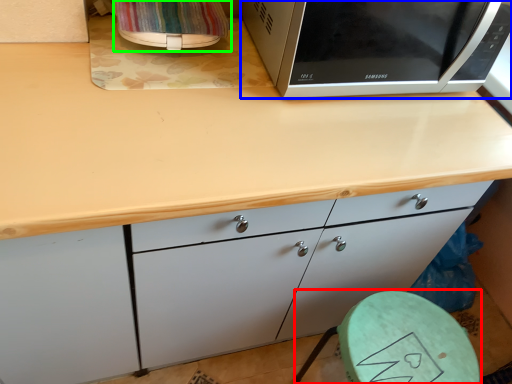
Question: Which object is the farthest from round table (highlighted by a red box)? Choose among these: microwave oven (highlighted by a blue box) or appliance (highlighted by a green box).

Choices:
 (A) microwave oven
 (B) appliance

Answer: (B)